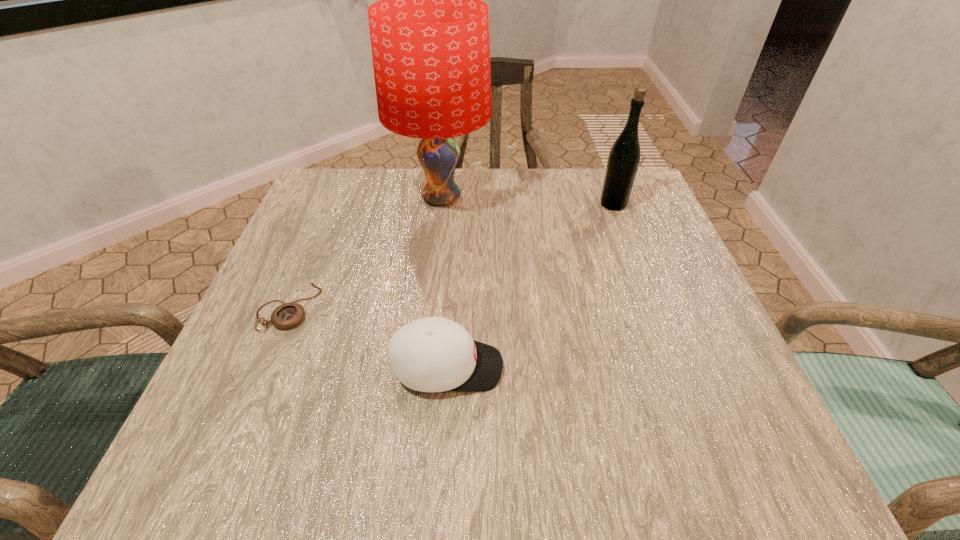
Identify the location of vacant space at the near left corner of the desktop. (221, 435).

This screenshot has width=960, height=540. I want to click on vacant space at the far right corner of the desktop, so click(x=592, y=170).

In the image, there is a desktop. Where is `free space at the near right corner`? The height and width of the screenshot is (540, 960). free space at the near right corner is located at coordinates (668, 417).

This screenshot has height=540, width=960. I want to click on free space between the rightmost object and the nearest object, so click(x=530, y=286).

Where is `vacant area between the rightmost object and the leftmost object`? vacant area between the rightmost object and the leftmost object is located at coordinates (450, 255).

The width and height of the screenshot is (960, 540). I want to click on unoccupied position between the rightmost object and the leftmost object, so click(x=450, y=255).

Find the location of a particular element. This screenshot has width=960, height=540. free point between the beer bottle and the nearest object is located at coordinates (530, 286).

This screenshot has width=960, height=540. Identify the location of unoccupied position between the tallest object and the rightmost object. (527, 201).

Locate an element on the screen. This screenshot has width=960, height=540. free space that is in between the third tallest object and the tallest object is located at coordinates (444, 282).

Where is `free area in between the rightmost object and the shortest object`? The height and width of the screenshot is (540, 960). free area in between the rightmost object and the shortest object is located at coordinates (450, 255).